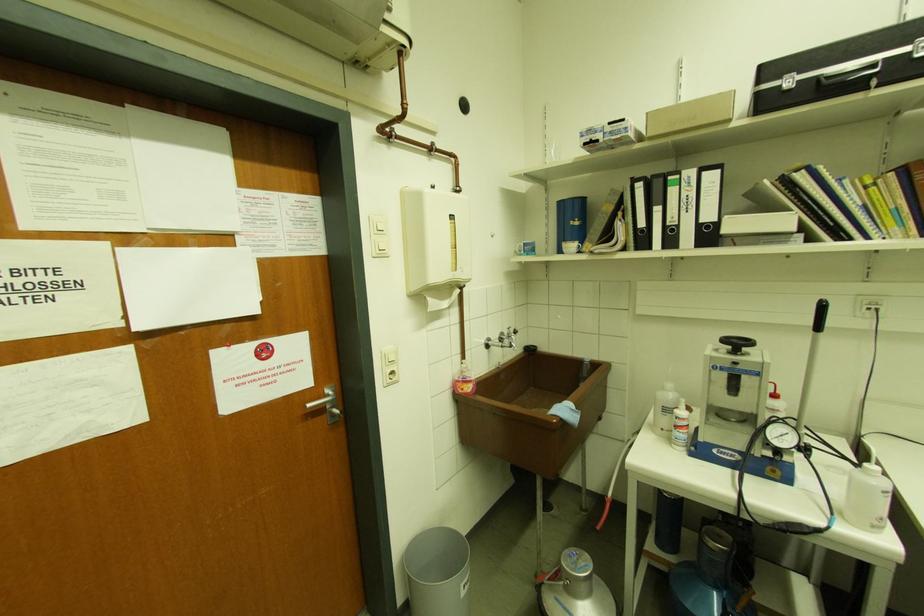
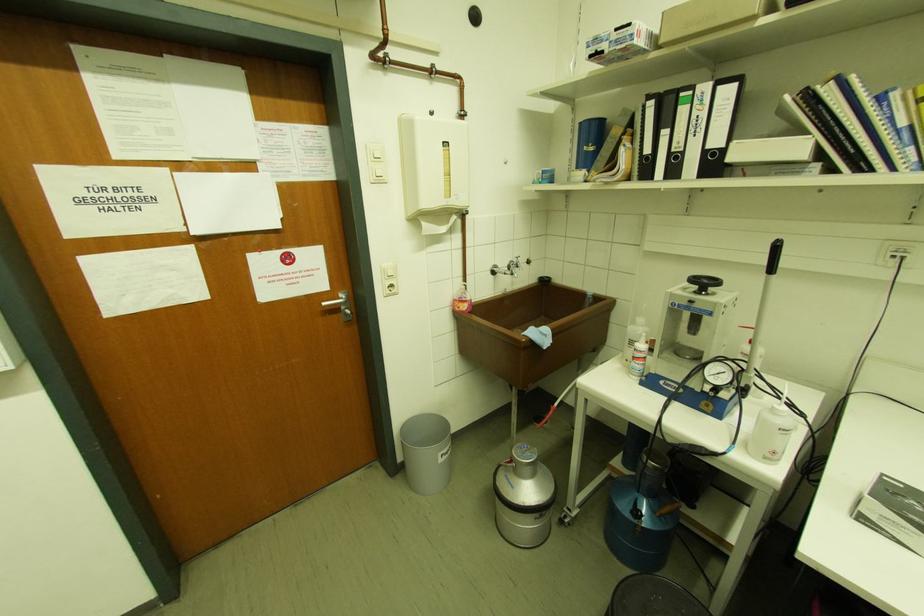
In the second image, find the point that corresponds to pixel 468 582 in the first image.

(446, 453)